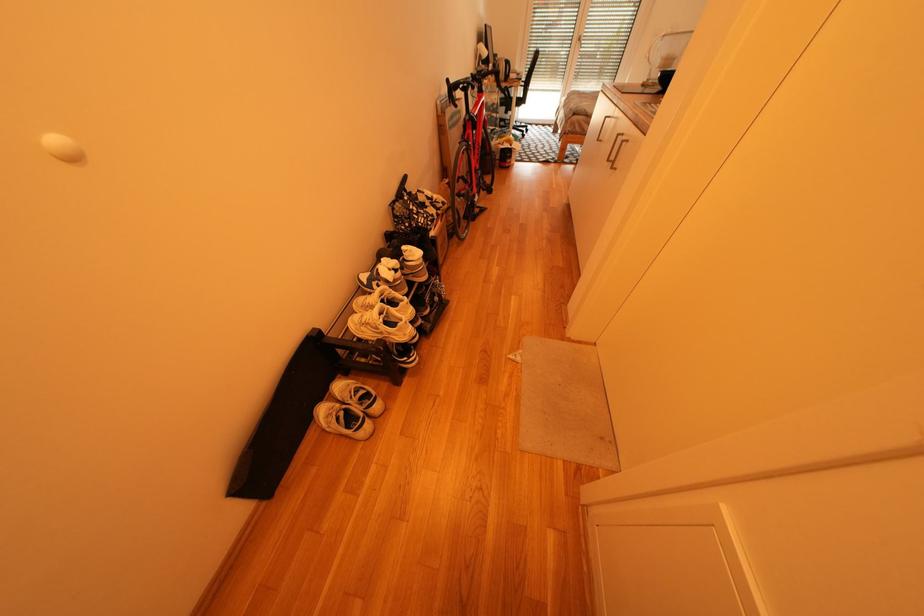
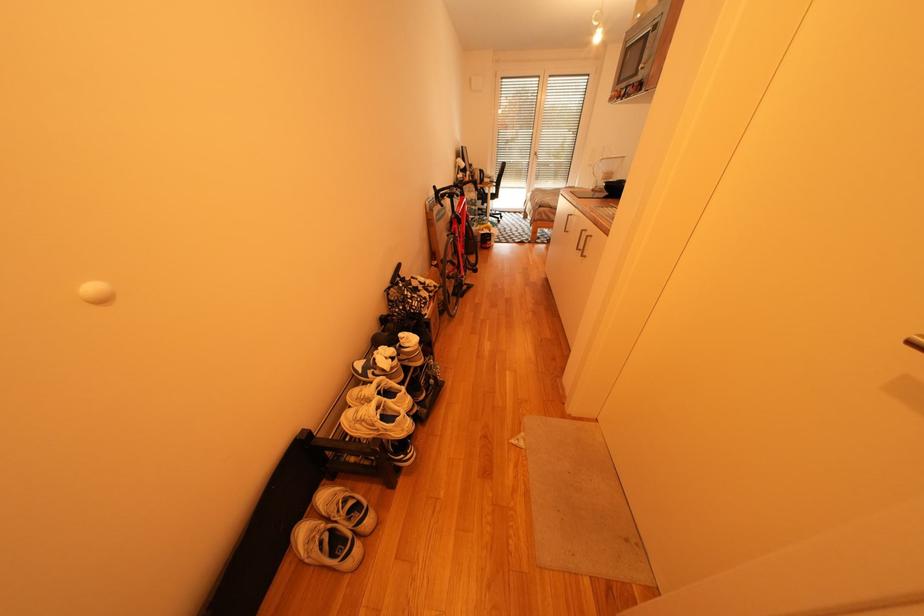
Which direction would the cameraman need to move to produce the second image?

The cameraman walked toward left, backward.